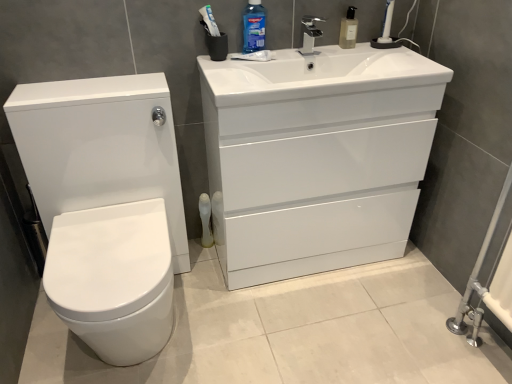
Question: Is blue glossy mouthwash at upper center, the first cleaning product in the left-to-right sequence, positioned with its back to white glossy toilet at left?

Choices:
 (A) yes
 (B) no

Answer: (B)

Question: From the image's perspective, does blue glossy mouthwash at upper center, the first cleaning product in the left-to-right sequence, appear lower than white glossy toilet at left?

Choices:
 (A) yes
 (B) no

Answer: (B)

Question: Can you confirm if blue glossy mouthwash at upper center, the 2th cleaning product from the right, is wider than white glossy toilet at left?

Choices:
 (A) no
 (B) yes

Answer: (A)

Question: Is the surface of blue glossy mouthwash at upper center, the first cleaning product in the left-to-right sequence, in direct contact with white glossy toilet at left?

Choices:
 (A) no
 (B) yes

Answer: (A)

Question: Is blue glossy mouthwash at upper center, the 2th cleaning product from the right, further to camera compared to white glossy toilet at left?

Choices:
 (A) no
 (B) yes

Answer: (B)

Question: Relative to white glossy drawer at center, is translucent plastic soap dispenser at upper center, positioned as the 2th cleaning product in left-to-right order, in front or behind?

Choices:
 (A) behind
 (B) front

Answer: (A)

Question: Based on their sizes in the image, would you say translucent plastic soap dispenser at upper center, positioned as the 2th cleaning product in left-to-right order, is bigger or smaller than white glossy drawer at center?

Choices:
 (A) big
 (B) small

Answer: (B)

Question: From a real-world perspective, is translucent plastic soap dispenser at upper center, positioned as the 2th cleaning product in left-to-right order, positioned above or below white glossy drawer at center?

Choices:
 (A) below
 (B) above

Answer: (B)

Question: From the image's perspective, is translucent plastic soap dispenser at upper center, positioned as the 2th cleaning product in left-to-right order, positioned above or below white glossy drawer at center?

Choices:
 (A) above
 (B) below

Answer: (A)

Question: Is white glossy cabinet at upper right taller or shorter than white glossy drawer at center?

Choices:
 (A) tall
 (B) short

Answer: (A)

Question: From the image's perspective, relative to white glossy drawer at center, is white glossy cabinet at upper right above or below?

Choices:
 (A) above
 (B) below

Answer: (B)

Question: From a real-world perspective, is white glossy cabinet at upper right above or below white glossy drawer at center?

Choices:
 (A) above
 (B) below

Answer: (B)

Question: Considering the positions of point (x=226, y=165) and point (x=278, y=105), is point (x=226, y=165) closer or farther from the camera than point (x=278, y=105)?

Choices:
 (A) farther
 (B) closer

Answer: (A)

Question: Is white glossy toilet at left wider or thinner than blue glossy mouthwash at upper center, the 2th cleaning product from the right?

Choices:
 (A) thin
 (B) wide

Answer: (B)

Question: From a real-world perspective, is white glossy toilet at left positioned above or below blue glossy mouthwash at upper center, the first cleaning product in the left-to-right sequence?

Choices:
 (A) above
 (B) below

Answer: (B)